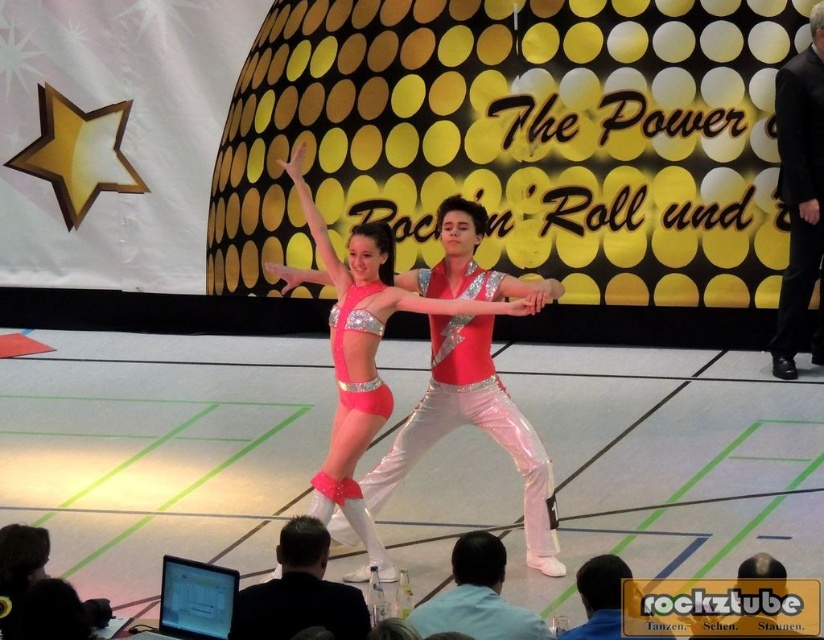
Question: Which point is closer to the camera taking this photo?

Choices:
 (A) (251, 625)
 (B) (598, 618)
 (C) (504, 566)

Answer: (B)

Question: Which of the following is the closest to the observer?

Choices:
 (A) pink shiny leotard at center
 (B) black leather jacket at lower center
 (C) shiny black suit at center

Answer: (C)

Question: Is pink shiny leotard at center below black leather jacket at lower center?

Choices:
 (A) no
 (B) yes

Answer: (A)

Question: Which point is closer to the camera?

Choices:
 (A) shiny black suit at center
 (B) black velvet suit at upper right

Answer: (A)

Question: Can you confirm if black velvet suit at upper right is positioned above shiny black suit at center?

Choices:
 (A) yes
 (B) no

Answer: (A)

Question: Is pink shiny leotard at center in front of shiny black suit at center?

Choices:
 (A) yes
 (B) no

Answer: (B)